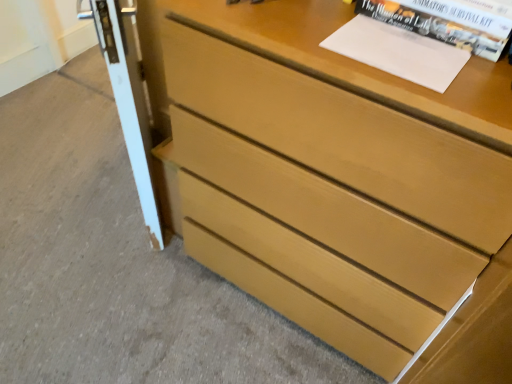
Question: From their relative heights in the image, would you say white glossy screen door at left is taller or shorter than light brown wood chest of drawers at center?

Choices:
 (A) short
 (B) tall

Answer: (A)

Question: Is white glossy screen door at left inside or outside of light brown wood chest of drawers at center?

Choices:
 (A) outside
 (B) inside

Answer: (A)

Question: Estimate the real-world distances between objects in this image. Which object is farther from the white glossy screen door at left?

Choices:
 (A) white paper at upper right
 (B) light brown wood chest of drawers at center

Answer: (A)

Question: Estimate the real-world distances between objects in this image. Which object is farther from the white paper at upper right?

Choices:
 (A) white glossy screen door at left
 (B) light brown wood chest of drawers at center

Answer: (A)